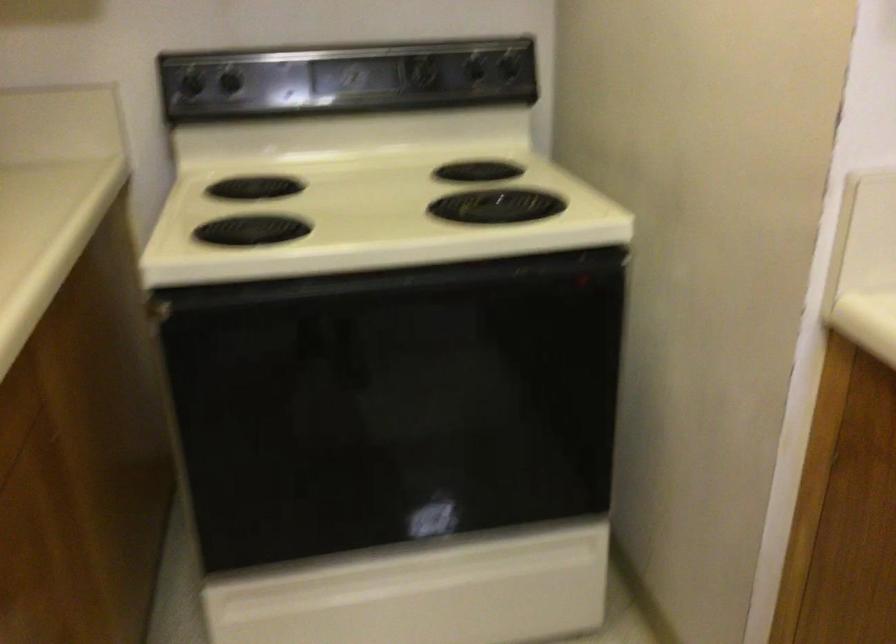
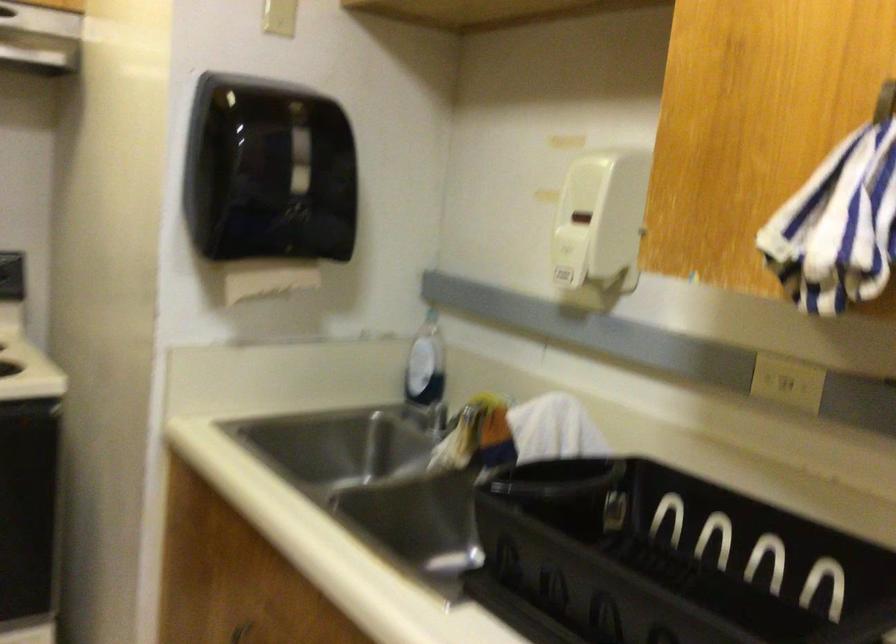
Question: How did the camera likely rotate?

Choices:
 (A) Left
 (B) Right
 (C) Up
 (D) Down

Answer: (B)